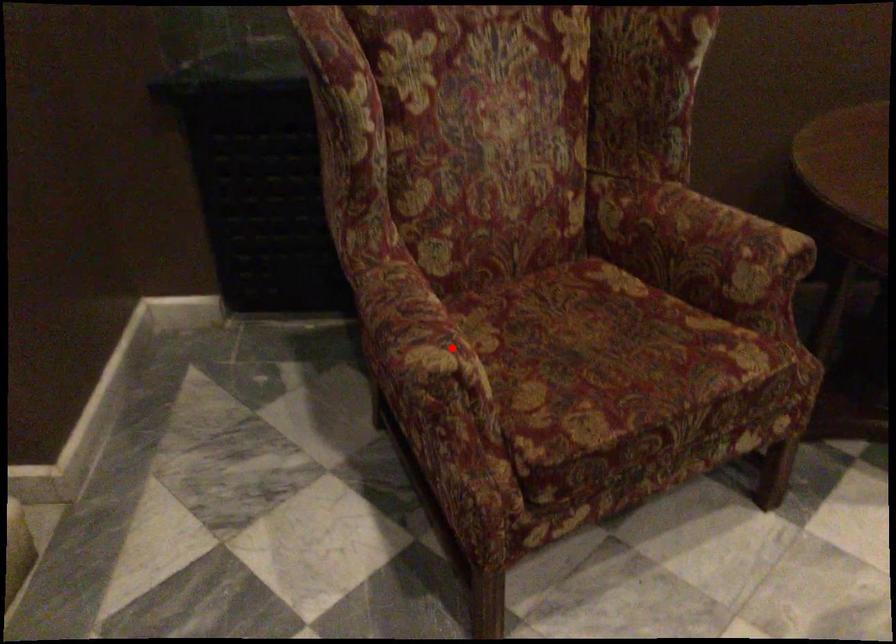
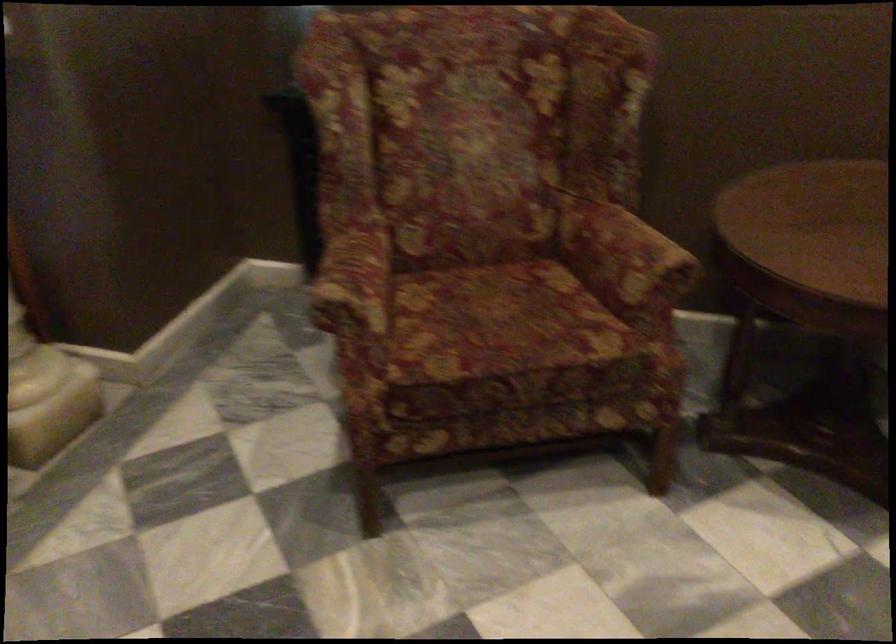
Question: I am providing you with two images of the same scene from different viewpoints. Image1 has a red point marked. In image2, the corresponding 3D location appears at what relative position? Reply with the corresponding letter.

Choices:
 (A) Closer
 (B) Farther

Answer: (B)